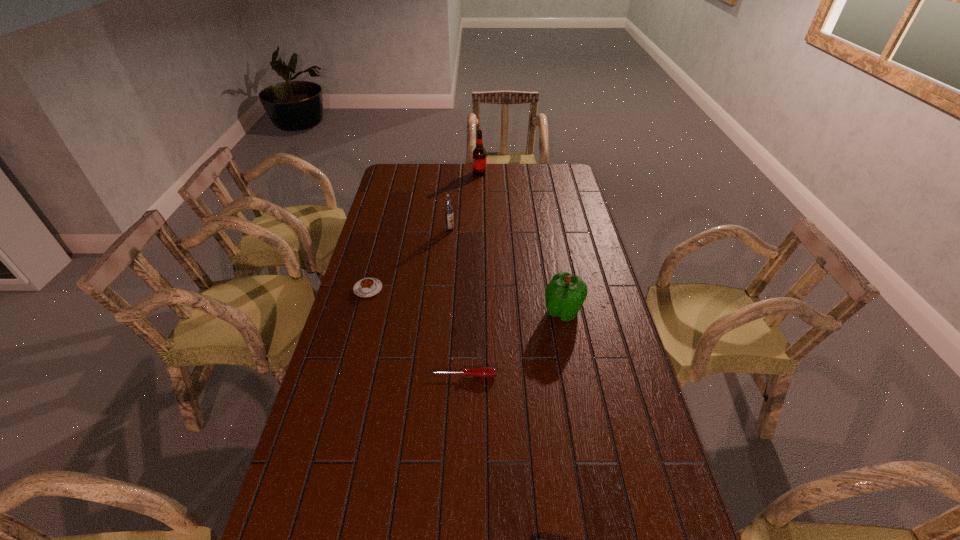
I want to click on free space located on the front of the bell pepper, so coord(572,357).

In order to click on vacant area located 0.390m on the right of the leftmost object in this screenshot , I will do `click(491, 289)`.

At what (x,y) coordinates should I click in order to perform the action: click on blank area located 0.220m on the front of the fifth farthest object. Please return your answer as a coordinate pair (x, y). Looking at the image, I should click on (461, 451).

What are the coordinates of `object that is at the far edge` in the screenshot? It's located at (479, 153).

The image size is (960, 540). I want to click on object that is at the left edge, so click(367, 287).

You are a GUI agent. You are given a task and a screenshot of the screen. Output one action in this format:
    pyautogui.click(x=<x>, y=<y>)
    Task: Click on the object that is at the right edge
    The height and width of the screenshot is (540, 960).
    Given the screenshot: What is the action you would take?
    pyautogui.click(x=565, y=294)

Image resolution: width=960 pixels, height=540 pixels. In the image, there is a desktop. In order to click on vacant space at the far edge in this screenshot , I will do `click(499, 177)`.

This screenshot has height=540, width=960. Find the location of `vacant space at the left edge`. vacant space at the left edge is located at coordinates (391, 215).

This screenshot has width=960, height=540. I want to click on vacant region at the right edge, so click(627, 353).

In the image, there is a desktop. Where is `free space at the far left corner`? The height and width of the screenshot is (540, 960). free space at the far left corner is located at coordinates (414, 168).